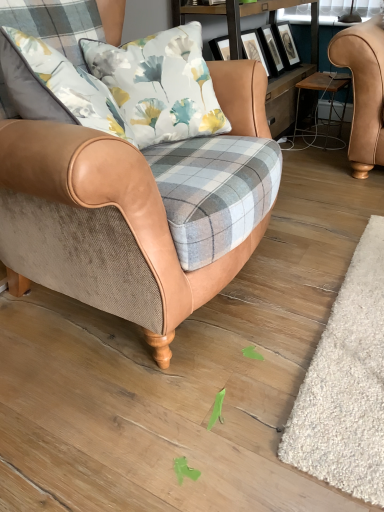
Question: Does white shaggy rug at lower right have a lesser height compared to wooden framed artwork at upper center?

Choices:
 (A) yes
 (B) no

Answer: (A)

Question: Is white shaggy rug at lower right completely or partially outside of wooden framed artwork at upper center?

Choices:
 (A) no
 (B) yes

Answer: (B)

Question: Are white shaggy rug at lower right and wooden framed artwork at upper center located far from each other?

Choices:
 (A) yes
 (B) no

Answer: (A)

Question: Is white shaggy rug at lower right beside wooden framed artwork at upper center?

Choices:
 (A) no
 (B) yes

Answer: (A)

Question: Is white shaggy rug at lower right to the right of wooden framed artwork at upper center from the viewer's perspective?

Choices:
 (A) yes
 (B) no

Answer: (A)

Question: Does white shaggy rug at lower right appear on the left side of wooden framed artwork at upper center?

Choices:
 (A) yes
 (B) no

Answer: (B)

Question: Does white shaggy rug at lower right have a greater width compared to tan leather armchair at center?

Choices:
 (A) yes
 (B) no

Answer: (A)

Question: Would you consider white shaggy rug at lower right to be distant from tan leather armchair at center?

Choices:
 (A) yes
 (B) no

Answer: (B)

Question: Does white shaggy rug at lower right have a smaller size compared to tan leather armchair at center?

Choices:
 (A) yes
 (B) no

Answer: (A)

Question: Is white shaggy rug at lower right directly adjacent to tan leather armchair at center?

Choices:
 (A) no
 (B) yes

Answer: (A)

Question: Is white shaggy rug at lower right oriented towards tan leather armchair at center?

Choices:
 (A) yes
 (B) no

Answer: (B)

Question: Considering the relative positions of white shaggy rug at lower right and tan leather armchair at center in the image provided, is white shaggy rug at lower right to the left of tan leather armchair at center from the viewer's perspective?

Choices:
 (A) no
 (B) yes

Answer: (A)

Question: Could you tell me if tan leather armchair at center is facing wooden framed artwork at upper center?

Choices:
 (A) no
 (B) yes

Answer: (A)